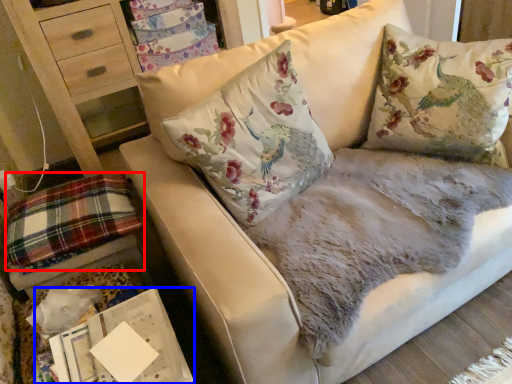
Question: Which object is closer to the camera taking this photo, plaid (highlighted by a red box) or magazine (highlighted by a blue box)?

Choices:
 (A) plaid
 (B) magazine

Answer: (B)